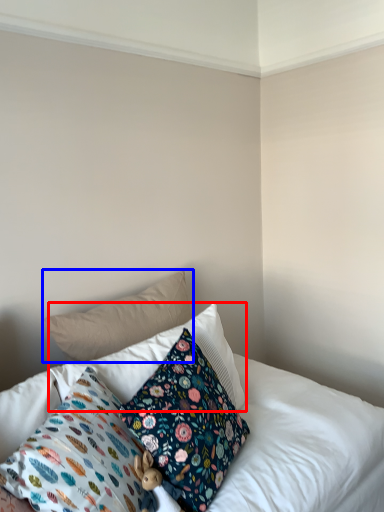
Question: Which of the following is the farthest to the observer, pillow (highlighted by a red box) or pillow (highlighted by a blue box)?

Choices:
 (A) pillow
 (B) pillow

Answer: (B)